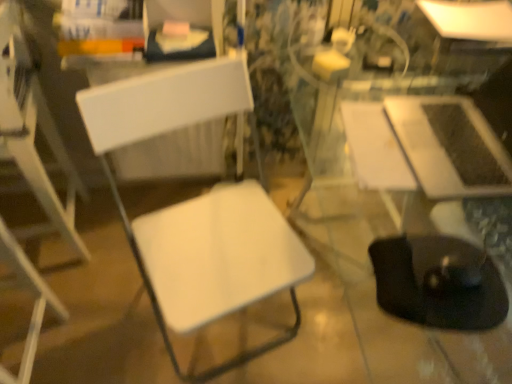
This screenshot has width=512, height=384. What do you see at coordinates (198, 207) in the screenshot?
I see `white matte chair at left, marked as the 1th chair in a right-to-left arrangement` at bounding box center [198, 207].

Find the location of a particular element. The image size is (512, 384). black rubber swivel chair at lower right is located at coordinates (436, 283).

Locate an element on the screen. This screenshot has height=384, width=512. white matte chair at left, marked as the 1th chair in a right-to-left arrangement is located at coordinates (198, 207).

Does white plastic chair at left, the 1th chair when ordered from left to right, have a greater width compared to white glossy table at upper right, which is the 1th table in top-to-bottom order?

No, white plastic chair at left, the 1th chair when ordered from left to right, is not wider than white glossy table at upper right, which is the 1th table in top-to-bottom order.

Could you tell me if white plastic chair at left, the 1th chair when ordered from left to right, is turned towards white glossy table at upper right, the 2th table positioned from the bottom?

No, white plastic chair at left, the 1th chair when ordered from left to right, is not aimed at white glossy table at upper right, the 2th table positioned from the bottom.

Starting from the white plastic chair at left, marked as the second chair in a right-to-left arrangement, which table is the 2nd one behind? Please provide its 2D coordinates.

[(469, 34)]

Considering the relative sizes of white plastic chair at left, the 1th chair when ordered from left to right, and white glossy table at upper right, marked as the second table in a front-to-back arrangement, in the image provided, is white plastic chair at left, the 1th chair when ordered from left to right, shorter than white glossy table at upper right, marked as the second table in a front-to-back arrangement,?

No.

Is white glossy table at upper right, which is the 1th table in top-to-bottom order, not inside white matte chair at left, marked as the 1th chair in a right-to-left arrangement?

Yes.

Between white glossy table at upper right, which is the 1th table in top-to-bottom order, and white matte chair at left, marked as the 1th chair in a right-to-left arrangement, which one is positioned behind?

Positioned behind is white glossy table at upper right, which is the 1th table in top-to-bottom order.

From a real-world perspective, which object rests below the other?

white matte chair at left, marked as the 1th chair in a right-to-left arrangement, is physically lower.

From a real-world perspective, starting from the black rubber swivel chair at lower right, which table is the 2nd one vertically above it? Please provide its 2D coordinates.

[(450, 146)]

From the image's perspective, which is above, satin silver laptop at right, which appears as the second table when viewed from the back, or black rubber swivel chair at lower right?

satin silver laptop at right, which appears as the second table when viewed from the back, from the image's perspective.

Which object is closer to the camera, satin silver laptop at right, placed as the first table when sorted from front to back, or black rubber swivel chair at lower right?

Positioned in front is black rubber swivel chair at lower right.

Who is taller, satin silver laptop at right, positioned as the second table in top-to-bottom order, or black rubber swivel chair at lower right?

satin silver laptop at right, positioned as the second table in top-to-bottom order.

Can you see black rubber swivel chair at lower right touching white glossy table at upper right, marked as the second table in a front-to-back arrangement?

There is a gap between black rubber swivel chair at lower right and white glossy table at upper right, marked as the second table in a front-to-back arrangement.

From the image's perspective, is black rubber swivel chair at lower right on top of white glossy table at upper right, the 2th table positioned from the bottom?

No, from the image's perspective, black rubber swivel chair at lower right is not on top of white glossy table at upper right, the 2th table positioned from the bottom.

Does black rubber swivel chair at lower right have a larger size compared to white glossy table at upper right, which is the 1th table in top-to-bottom order?

No.

Is white matte chair at left, the 2th chair from the left, positioned beyond the bounds of black rubber swivel chair at lower right?

Yes.

Considering the positions of objects white matte chair at left, the 2th chair from the left, and black rubber swivel chair at lower right in the image provided, who is more to the left, white matte chair at left, the 2th chair from the left, or black rubber swivel chair at lower right?

From the viewer's perspective, white matte chair at left, the 2th chair from the left, appears more on the left side.

Could you tell me if white matte chair at left, the 2th chair from the left, is facing black rubber swivel chair at lower right?

Yes.

Which is farther, (117, 143) or (372, 263)?

The point (117, 143) is farther.

Considering the sizes of satin silver laptop at right, which appears as the second table when viewed from the back, and white matte chair at left, marked as the 1th chair in a right-to-left arrangement, in the image, is satin silver laptop at right, which appears as the second table when viewed from the back, taller or shorter than white matte chair at left, marked as the 1th chair in a right-to-left arrangement,?

satin silver laptop at right, which appears as the second table when viewed from the back, is shorter than white matte chair at left, marked as the 1th chair in a right-to-left arrangement.

Is satin silver laptop at right, the first table from the bottom, located outside white matte chair at left, the 2th chair from the left?

Absolutely, satin silver laptop at right, the first table from the bottom, is external to white matte chair at left, the 2th chair from the left.

From the image's perspective, is satin silver laptop at right, which appears as the second table when viewed from the back, located beneath white matte chair at left, marked as the 1th chair in a right-to-left arrangement?

No, from the image's perspective, satin silver laptop at right, which appears as the second table when viewed from the back, is not below white matte chair at left, marked as the 1th chair in a right-to-left arrangement.

Between satin silver laptop at right, which appears as the second table when viewed from the back, and white matte chair at left, the 2th chair from the left, which one appears on the left side from the viewer's perspective?

white matte chair at left, the 2th chair from the left.

From a real-world perspective, is white plastic chair at left, the 1th chair when ordered from left to right, located beneath black rubber swivel chair at lower right?

Indeed, from a real-world perspective, white plastic chair at left, the 1th chair when ordered from left to right, is positioned beneath black rubber swivel chair at lower right.

Based on the photo, is white plastic chair at left, the 1th chair when ordered from left to right, far from black rubber swivel chair at lower right?

Yes, white plastic chair at left, the 1th chair when ordered from left to right, and black rubber swivel chair at lower right are quite far apart.

Between white plastic chair at left, marked as the second chair in a right-to-left arrangement, and black rubber swivel chair at lower right, which one has larger size?

white plastic chair at left, marked as the second chair in a right-to-left arrangement.

How different are the orientations of white plastic chair at left, marked as the second chair in a right-to-left arrangement, and black rubber swivel chair at lower right in degrees?

The angular difference between white plastic chair at left, marked as the second chair in a right-to-left arrangement, and black rubber swivel chair at lower right is 6.22 degrees.

Find the location of a particular element. This screenshot has height=384, width=512. the 2nd table above when counting from the white plastic chair at left, the 1th chair when ordered from left to right (from the image's perspective) is located at coordinates (469, 34).

From a real-world perspective, which table is the 1st one above the white matte chair at left, marked as the 1th chair in a right-to-left arrangement? Please provide its 2D coordinates.

[(469, 34)]

Based on their spatial positions, is white matte chair at left, the 2th chair from the left, or white plastic chair at left, marked as the second chair in a right-to-left arrangement, further from white glossy table at upper right, acting as the 1th table starting from the back?

white plastic chair at left, marked as the second chair in a right-to-left arrangement, is further to white glossy table at upper right, acting as the 1th table starting from the back.

Estimate the real-world distances between objects in this image. Which object is closer to satin silver laptop at right, placed as the first table when sorted from front to back, white glossy table at upper right, marked as the second table in a front-to-back arrangement, or white plastic chair at left, marked as the second chair in a right-to-left arrangement?

The object closer to satin silver laptop at right, placed as the first table when sorted from front to back, is white glossy table at upper right, marked as the second table in a front-to-back arrangement.

When comparing their distances from black rubber swivel chair at lower right, does white glossy table at upper right, acting as the 1th table starting from the back, or white plastic chair at left, marked as the second chair in a right-to-left arrangement, seem further?

white plastic chair at left, marked as the second chair in a right-to-left arrangement.

In the scene shown: Based on their spatial positions, is white plastic chair at left, marked as the second chair in a right-to-left arrangement, or white glossy table at upper right, which is the 1th table in top-to-bottom order, closer to black rubber swivel chair at lower right?

white glossy table at upper right, which is the 1th table in top-to-bottom order, is positioned closer to the anchor black rubber swivel chair at lower right.

From the image, which object appears to be farther from white glossy table at upper right, marked as the second table in a front-to-back arrangement, white matte chair at left, marked as the 1th chair in a right-to-left arrangement, or satin silver laptop at right, positioned as the second table in top-to-bottom order?

white matte chair at left, marked as the 1th chair in a right-to-left arrangement.

Which object lies further to the anchor point black rubber swivel chair at lower right, satin silver laptop at right, placed as the first table when sorted from front to back, or white matte chair at left, marked as the 1th chair in a right-to-left arrangement?

white matte chair at left, marked as the 1th chair in a right-to-left arrangement, is further to black rubber swivel chair at lower right.

Which object lies nearer to the anchor point white matte chair at left, the 2th chair from the left, black rubber swivel chair at lower right or satin silver laptop at right, which appears as the second table when viewed from the back?

Among the two, black rubber swivel chair at lower right is located nearer to white matte chair at left, the 2th chair from the left.

Which object lies nearer to the anchor point white matte chair at left, the 2th chair from the left, white glossy table at upper right, acting as the 1th table starting from the back, or white plastic chair at left, marked as the second chair in a right-to-left arrangement?

white plastic chair at left, marked as the second chair in a right-to-left arrangement, lies closer to white matte chair at left, the 2th chair from the left, than the other object.

Where is `chair between white plastic chair at left, the 1th chair when ordered from left to right, and white glossy table at upper right, the 2th table positioned from the bottom, from left to right`? This screenshot has width=512, height=384. chair between white plastic chair at left, the 1th chair when ordered from left to right, and white glossy table at upper right, the 2th table positioned from the bottom, from left to right is located at coordinates (198, 207).

Locate an element on the screen. table between white matte chair at left, the 2th chair from the left, and white glossy table at upper right, acting as the 1th table starting from the back is located at coordinates (450, 146).

The width and height of the screenshot is (512, 384). What are the coordinates of `swivel chair between white plastic chair at left, the 1th chair when ordered from left to right, and white glossy table at upper right, marked as the second table in a front-to-back arrangement, in the horizontal direction` in the screenshot? It's located at (436, 283).

This screenshot has width=512, height=384. Identify the location of swivel chair between white plastic chair at left, the 1th chair when ordered from left to right, and satin silver laptop at right, which appears as the second table when viewed from the back, in the horizontal direction. (436, 283).